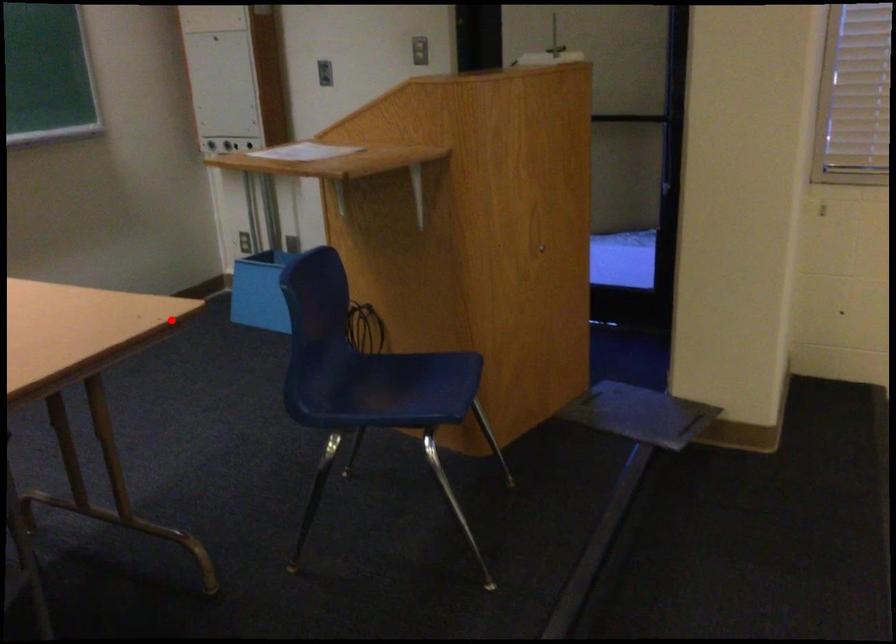
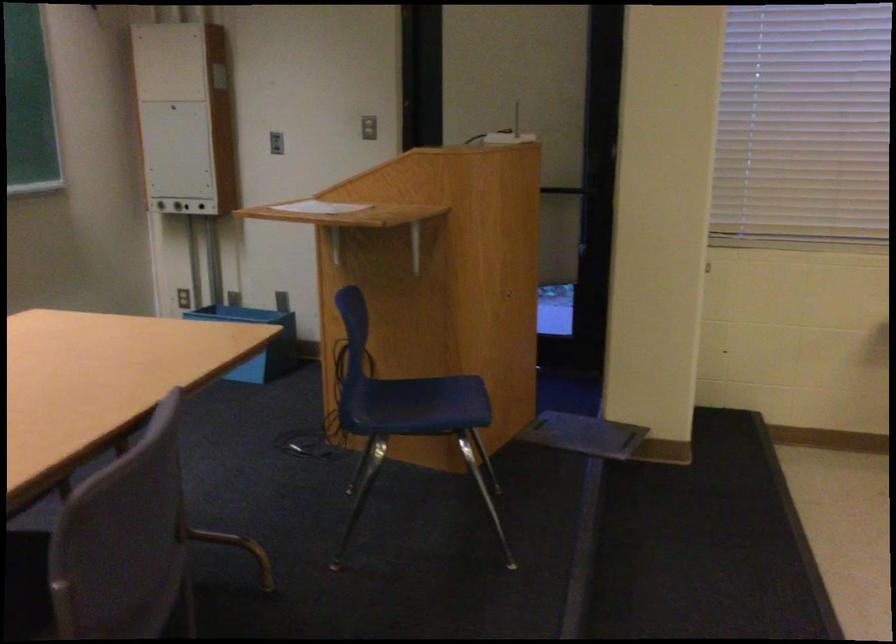
Find the pixel in the second image that matches the highlighted location in the first image.

(256, 341)